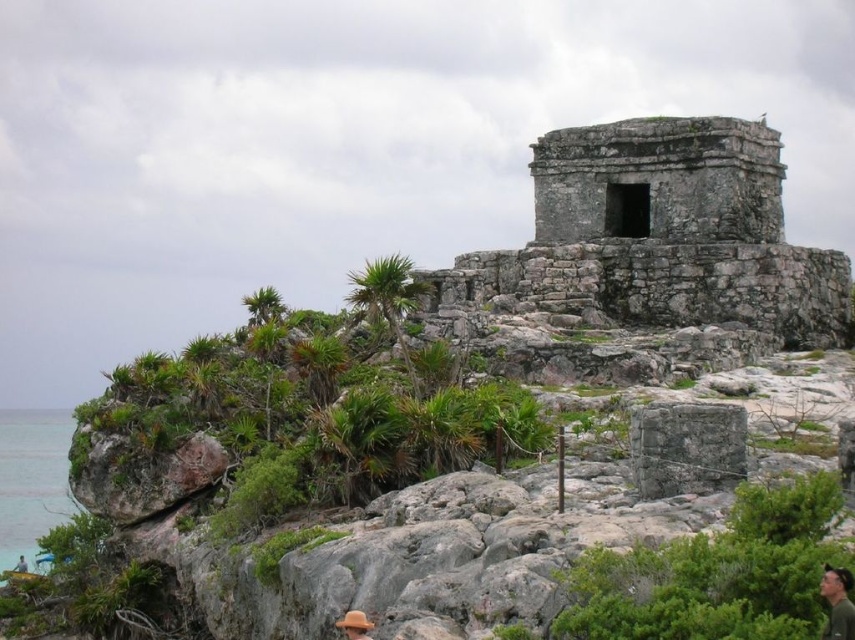
Does point (363, 371) lie behind point (18, 524)?

No, (363, 371) is in front of (18, 524).

Identify the location of green leafy plants at center. The width and height of the screenshot is (855, 640). (284, 424).

Is gray stone at center below green fabric cap at upper right?

Actually, gray stone at center is above green fabric cap at upper right.

Who is lower down, gray stone at center or green fabric cap at upper right?

Result: green fabric cap at upper right is lower down.

Is point (708, 465) positioned behind point (844, 592)?

Yes, it is.

This screenshot has width=855, height=640. I want to click on gray stone at center, so click(687, 448).

Find the location of a particular element. gray stone at center is located at coordinates (687, 448).

Does gray stone at center appear on the left side of clear blue water at lower left?

No, gray stone at center is not to the left of clear blue water at lower left.

You are a GUI agent. You are given a task and a screenshot of the screen. Output one action in this format:
    pyautogui.click(x=<x>, y=<y>)
    Task: Click on the gray stone at center
    The image size is (855, 640).
    Given the screenshot: What is the action you would take?
    pyautogui.click(x=687, y=448)

Identify the location of gray stone at center. (687, 448).